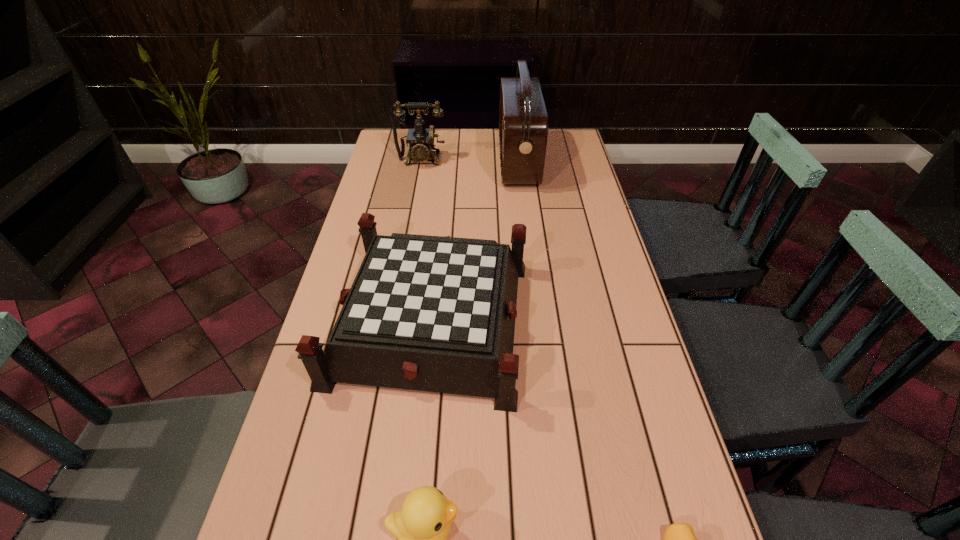
Image resolution: width=960 pixels, height=540 pixels. In order to click on object that is the third closest to the third tallest object in this screenshot , I will do `click(523, 121)`.

Identify the location of object that is the second closest to the shorter duck. (422, 526).